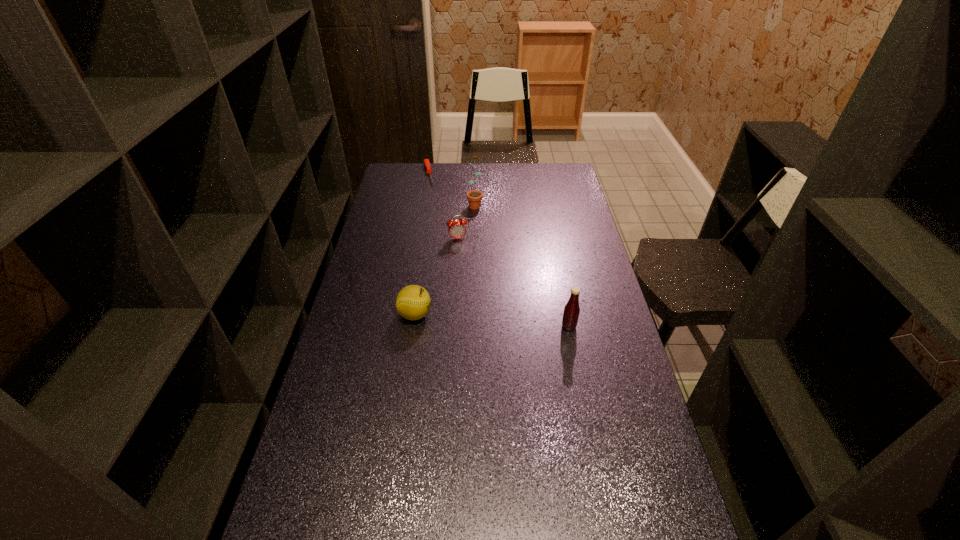
I want to click on softball, so click(x=413, y=302).

Locate an element on the screen. the fourth shortest object is located at coordinates (571, 311).

Find the location of a particular element. Image resolution: width=960 pixels, height=540 pixels. Tabasco sauce is located at coordinates (571, 311).

Find the location of a particular element. This screenshot has height=540, width=960. the second farthest object is located at coordinates (474, 197).

This screenshot has height=540, width=960. In order to click on the tallest object in this screenshot , I will do `click(474, 197)`.

The height and width of the screenshot is (540, 960). I want to click on alarm clock, so click(x=457, y=229).

Locate an element on the screen. Image resolution: width=960 pixels, height=540 pixels. the shortest object is located at coordinates (426, 161).

I want to click on screwdriver, so click(426, 161).

Where is `vacant space located 0.200m on the logo side of the softball`? The image size is (960, 540). vacant space located 0.200m on the logo side of the softball is located at coordinates (492, 314).

This screenshot has height=540, width=960. I want to click on free location located 0.330m on the left of the rightmost object, so click(x=460, y=326).